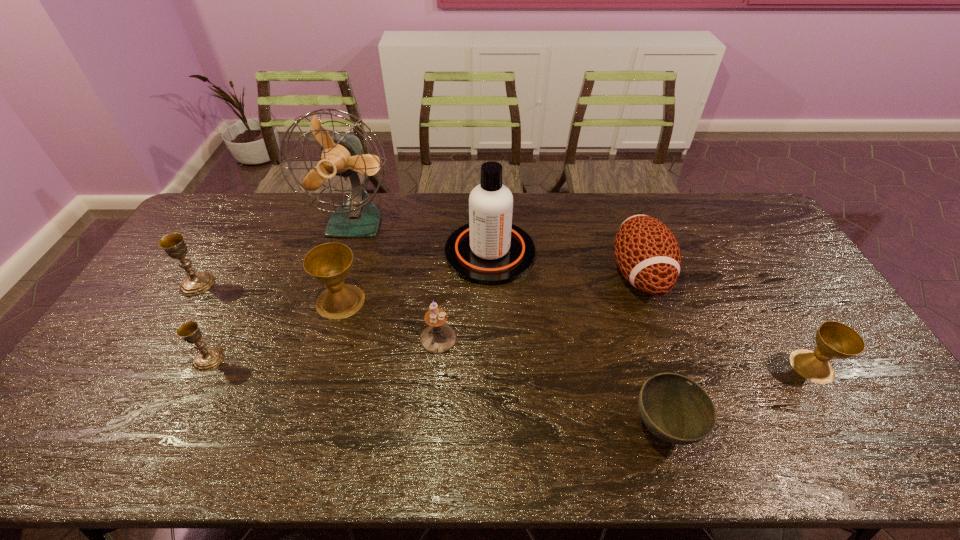
The height and width of the screenshot is (540, 960). Identify the location of fan. (342, 155).

At what (x,y) coordinates should I click in order to perform the action: click on the tallest object. Please return your answer as a coordinate pair (x, y). The height and width of the screenshot is (540, 960). Looking at the image, I should click on (342, 155).

Where is `white cleansing agent`? white cleansing agent is located at coordinates (489, 250).

In order to click on cleansing agent in this screenshot , I will do `click(489, 250)`.

Locate an element on the screen. The image size is (960, 540). football is located at coordinates (647, 253).

I want to click on the bigger gold chalice, so (173, 244).

The image size is (960, 540). In order to click on the left gold chalice in this screenshot , I will do `click(173, 244)`.

Locate an element on the screen. the third chalice from left to right is located at coordinates (329, 264).

Locate an element on the screen. The image size is (960, 540). the left brown chalice is located at coordinates (329, 264).

You are a GUI agent. You are given a task and a screenshot of the screen. Output one action in this format:
    pyautogui.click(x=<x>, y=<y>)
    Task: Click on the candle holder
    
    Given the screenshot: What is the action you would take?
    pyautogui.click(x=438, y=337)